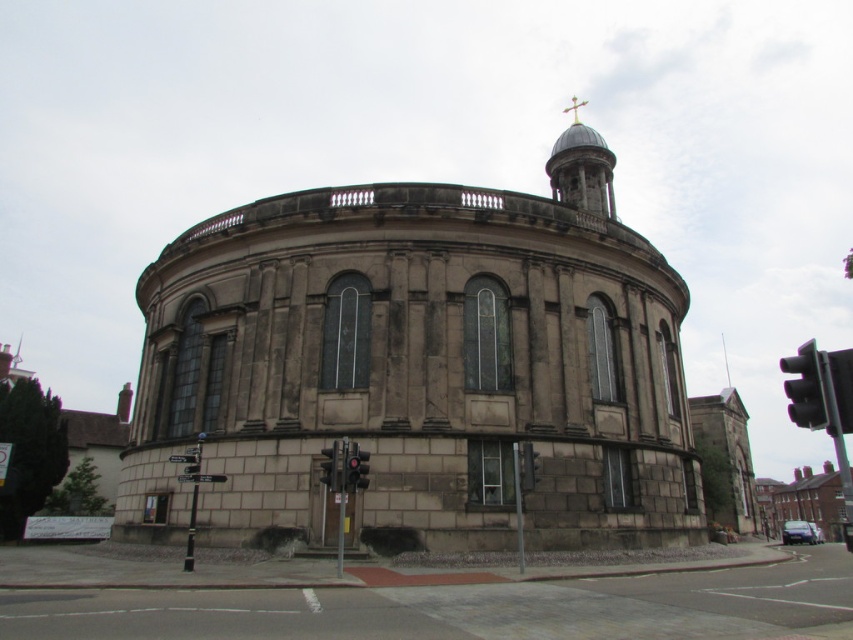
Does stone church at center appear on the right side of metallic traffic light at lower center?

Indeed, stone church at center is positioned on the right side of metallic traffic light at lower center.

Can you confirm if stone church at center is positioned below metallic traffic light at lower center?

Incorrect, stone church at center is not positioned below metallic traffic light at lower center.

Is point (543, 252) positioned after point (340, 468)?

Yes, it is behind point (340, 468).

The width and height of the screenshot is (853, 640). Identify the location of stone church at center. (421, 365).

Which is above, black glass traffic light at right or metallic traffic light at lower center?

Positioned higher is metallic traffic light at lower center.

Can you confirm if black glass traffic light at right is positioned above metallic traffic light at lower center?

No.

The width and height of the screenshot is (853, 640). I want to click on black glass traffic light at right, so click(x=805, y=387).

Does stone church at center appear on the right side of black glass traffic light at right?

No, stone church at center is not to the right of black glass traffic light at right.

Is stone church at center to the left of black glass traffic light at right from the viewer's perspective?

Indeed, stone church at center is positioned on the left side of black glass traffic light at right.

What do you see at coordinates (421, 365) in the screenshot? I see `stone church at center` at bounding box center [421, 365].

Locate an element on the screen. This screenshot has width=853, height=640. stone church at center is located at coordinates (421, 365).